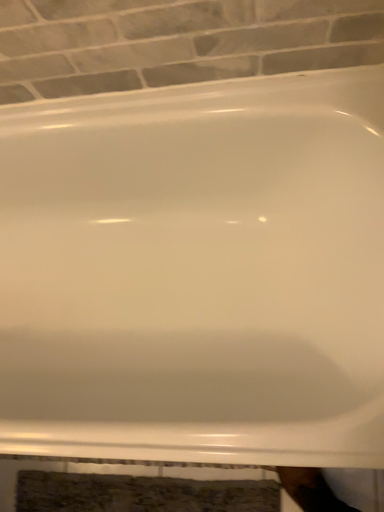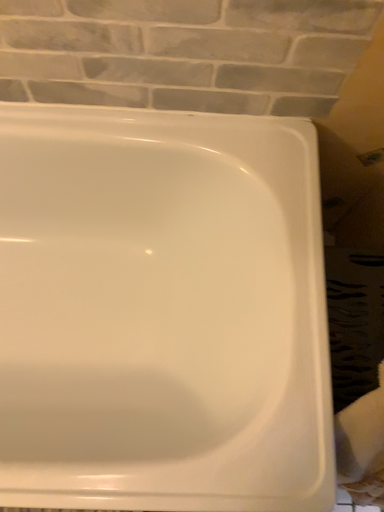
Question: Which way did the camera rotate in the video?

Choices:
 (A) rotated right
 (B) rotated left

Answer: (A)